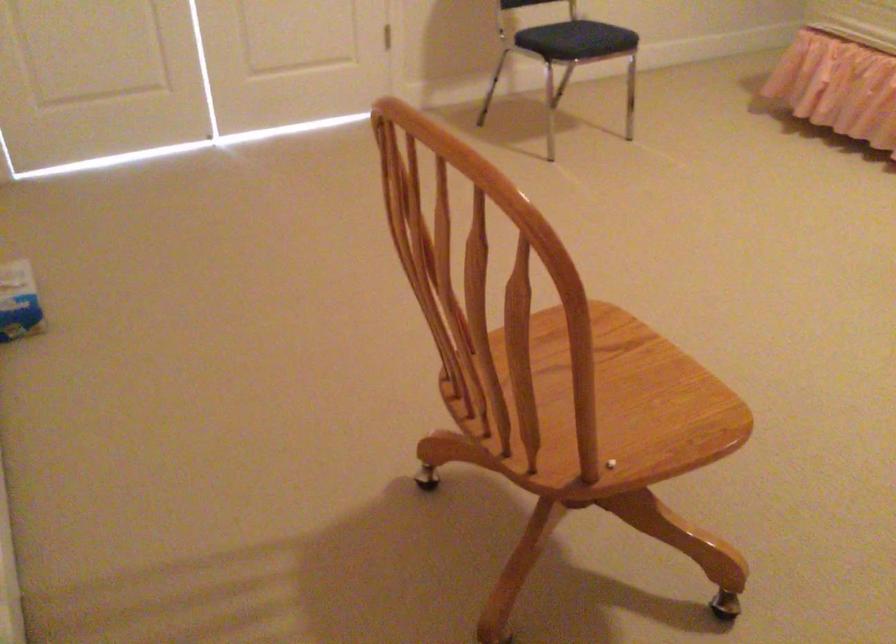
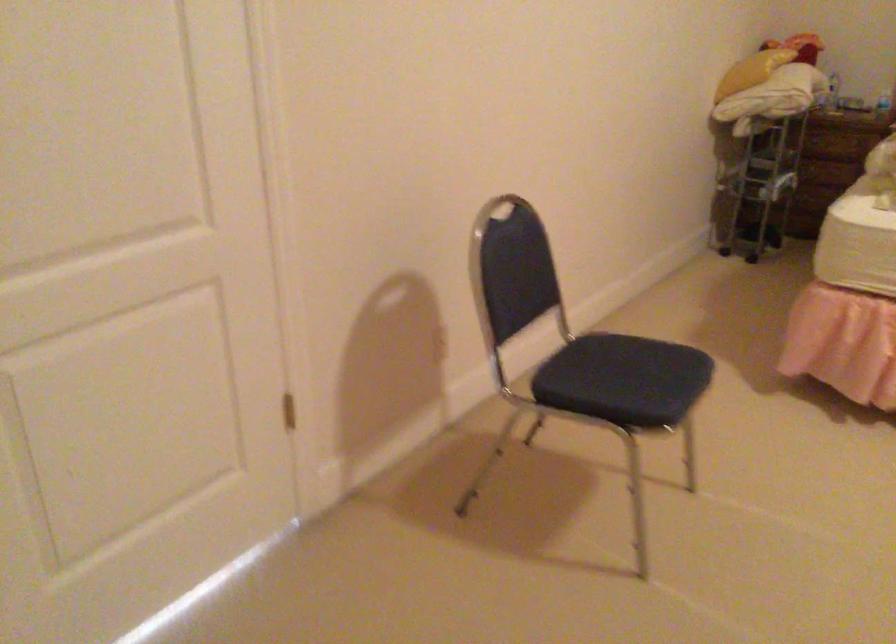
In a continuous first-person perspective shot, in which direction is the camera moving?

The cameraman moved toward left, forward.